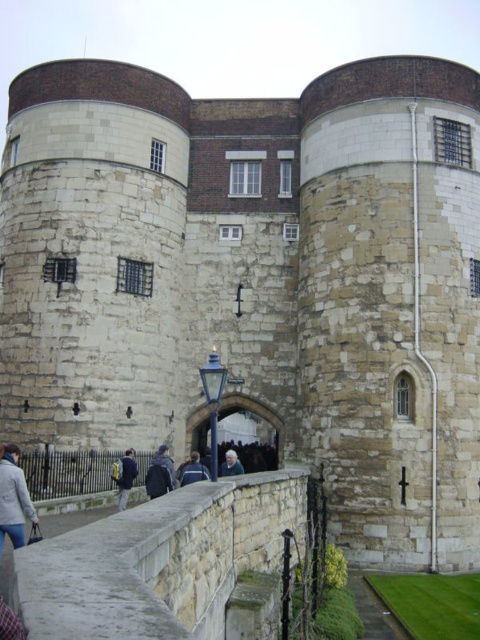
You are a tour guide leading a group around this historic stone building. You notice two jackets left behind by visitors. The light gray fabric jacket at lower left and the blue denim jacket at lower center. If you want to retrieve both jackets and place them on a 15 meter long bench nearby, will the bench be long enough to hold both jackets with a 1 meter gap between them?

→ The distance between the light gray fabric jacket at lower left and the blue denim jacket at lower center is 12.96 meters. To place both jackets on a bench with a 1 meter gap between them, the required bench length would be 12.96 meters plus 1 meter, totaling 13.96 meters. Since the bench is 15 meters long, it is long enough to accommodate both jackets with the desired gap.